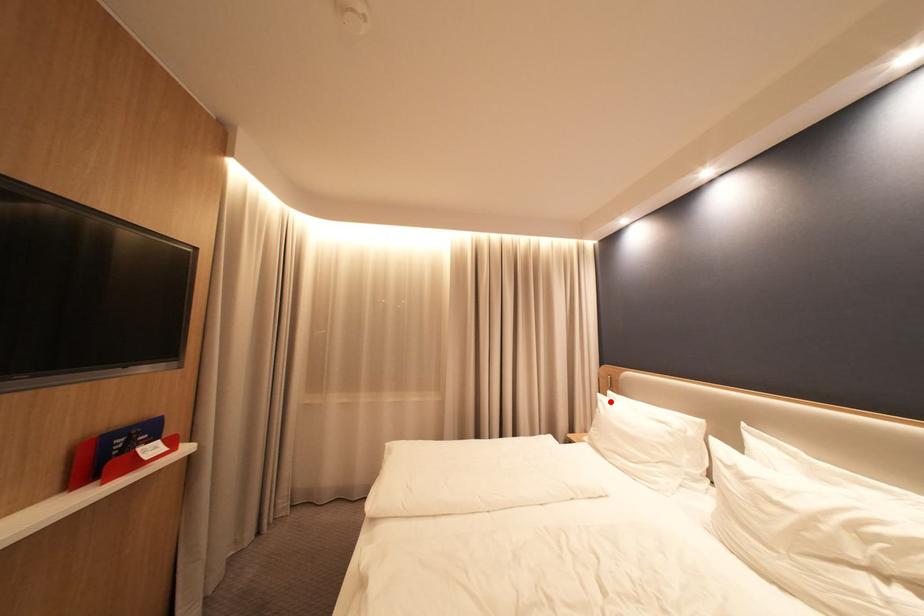
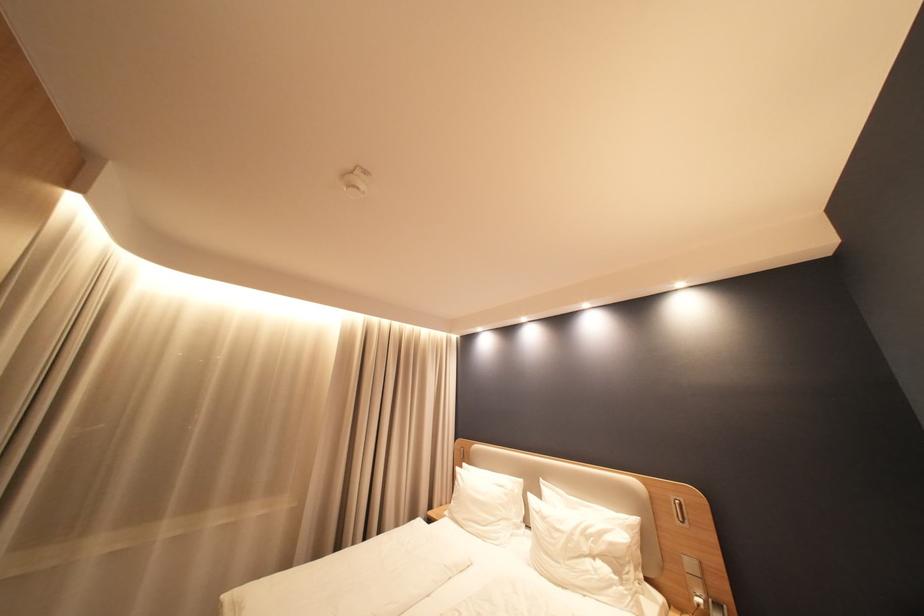
Locate, in the second image, the point that corresponds to the highlighted location in the first image.

(468, 475)